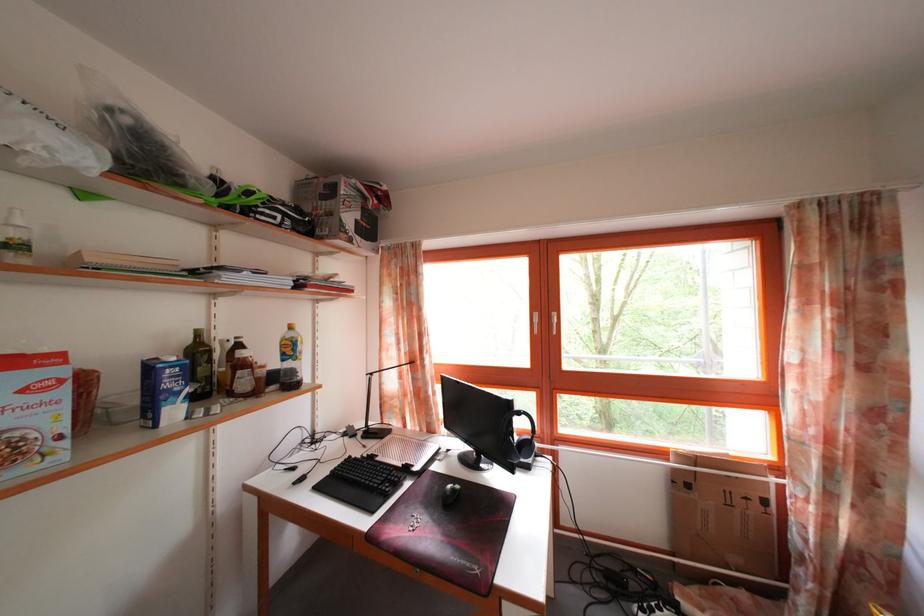
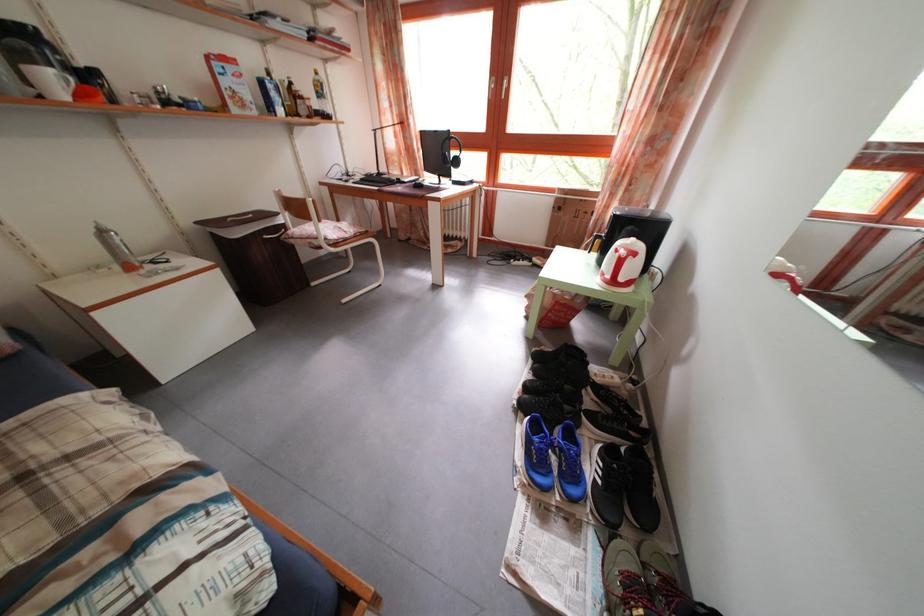
The point at (298, 334) is marked in the first image. Where is the corresponding point in the second image?

(323, 79)